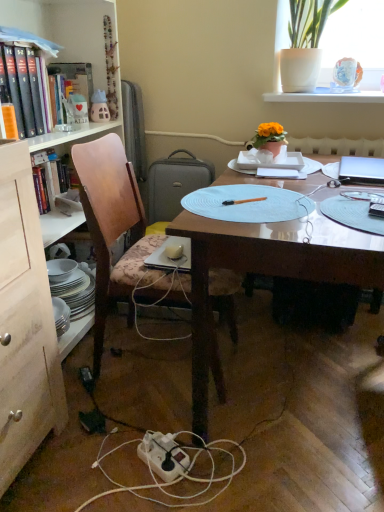
What are the coordinates of `free space that is in between black plastic power plugs and sockets at lower left, which appears as the 1th power plugs and sockets when viewed from the top, and white plastic power plugs and sockets at lower center, which ranks as the 2th power plugs and sockets in top-to-bottom order` in the screenshot? It's located at [90, 401].